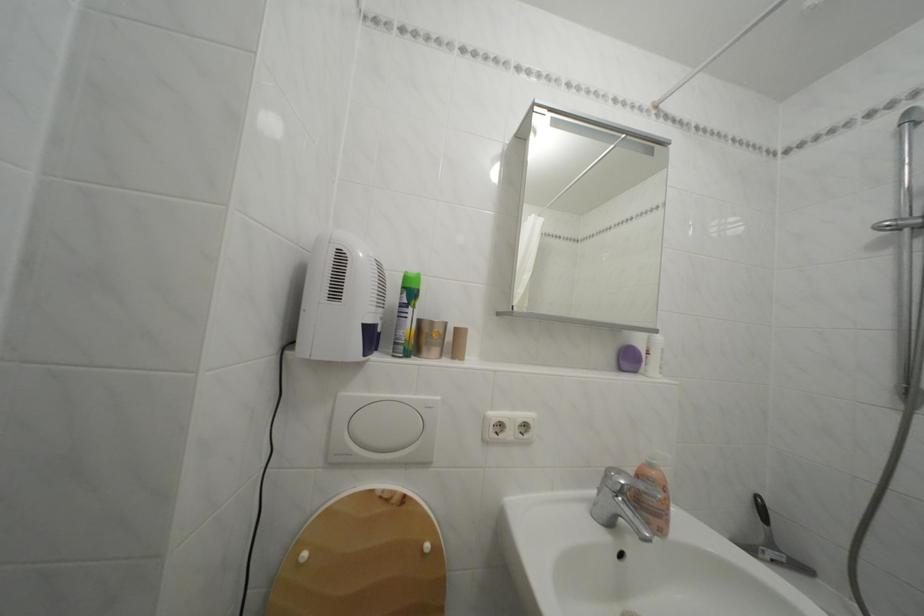
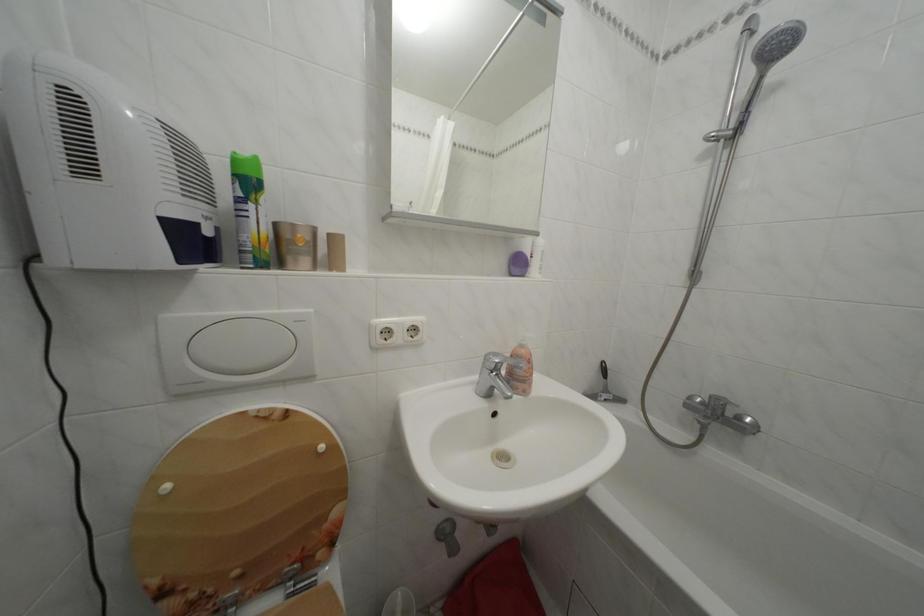
Where in the second image is the point corresponding to [660,472] from the first image?

(530, 352)